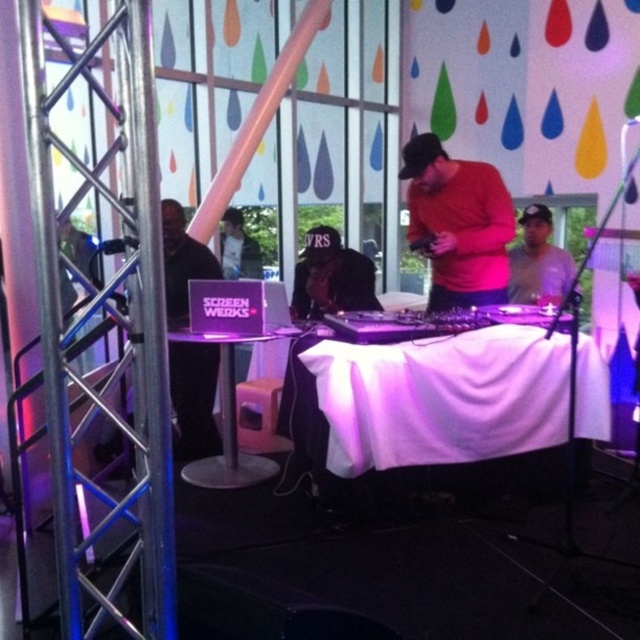
Looking at this image, is gray matte shirt at center wider than matte black laptop at center?

Correct, the width of gray matte shirt at center exceeds that of matte black laptop at center.

Between point (520, 257) and point (244, 244), which one is positioned in front?

Point (520, 257) is more forward.

I want to click on gray matte shirt at center, so click(x=538, y=260).

Can you confirm if matte red shirt at center is taller than matte black headphones at center?

Correct, matte red shirt at center is much taller as matte black headphones at center.

Is point (456, 163) farther from camera compared to point (305, 310)?

No, (456, 163) is closer to viewer.

Identify the location of matte red shirt at center. 458,224.

This screenshot has width=640, height=640. I want to click on matte red shirt at center, so click(458, 224).

Does white cloth-covered table at center have a larger size compared to purple fabric-covered table at center?

Correct, white cloth-covered table at center is larger in size than purple fabric-covered table at center.

Find the location of `white cloth-covered table at center`. white cloth-covered table at center is located at coordinates (435, 412).

This screenshot has height=640, width=640. Identify the location of white cloth-covered table at center. (x=435, y=412).